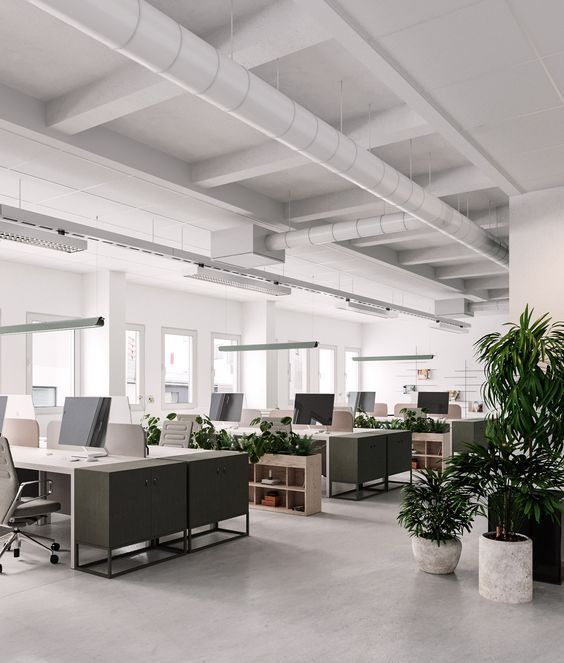
Find the location of a particular element. wheels on chair is located at coordinates (57, 554), (56, 540), (3, 560), (7, 540).